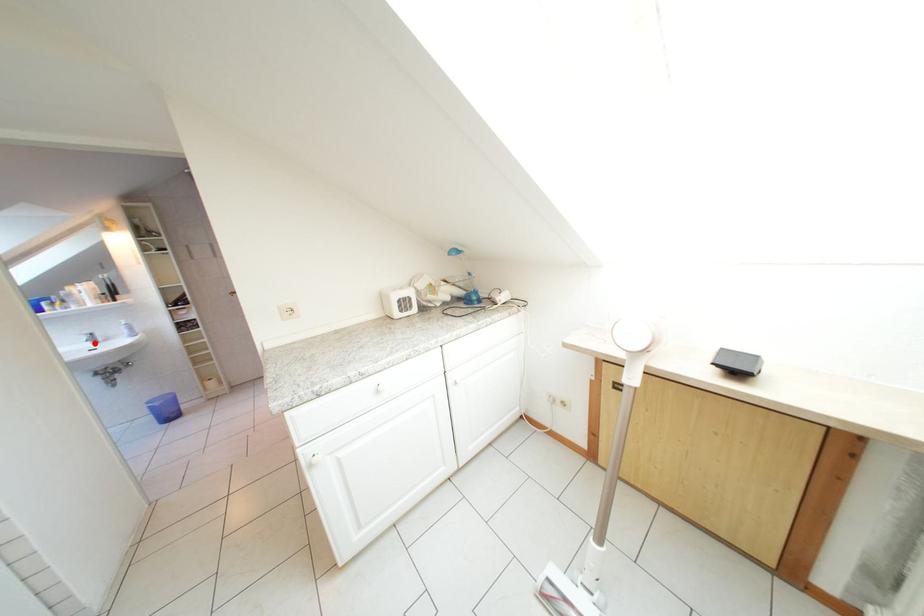
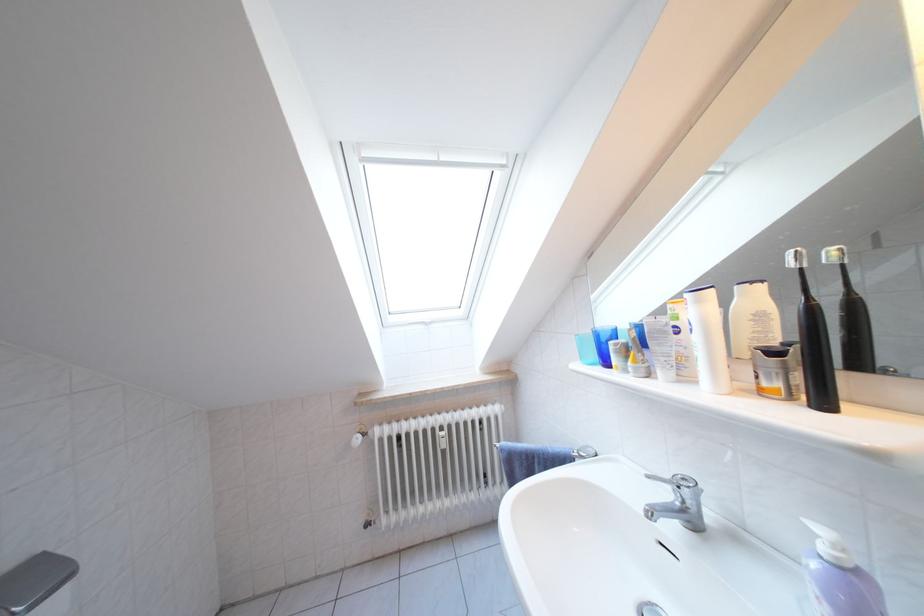
Where in the second image is the point corresponding to the highlighted location from the first image?

(675, 500)